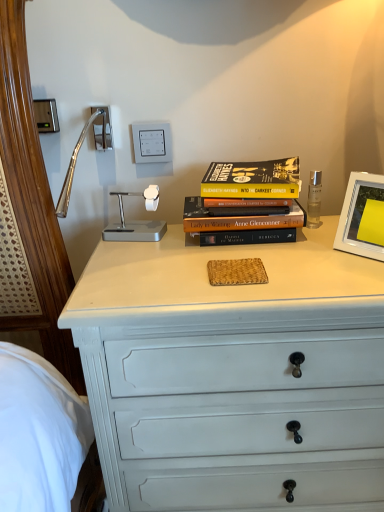
Question: Should I look upward or downward to see white plastic picture frame at upper right?

Choices:
 (A) up
 (B) down

Answer: (A)

Question: Does white painted wood chest of drawers at center have a greater height compared to white plastic switch at upper center, which appears as the first electric outlet when viewed from the right?

Choices:
 (A) no
 (B) yes

Answer: (B)

Question: Does white painted wood chest of drawers at center come behind white plastic switch at upper center, which appears as the first electric outlet when viewed from the right?

Choices:
 (A) no
 (B) yes

Answer: (A)

Question: From the image's perspective, would you say white painted wood chest of drawers at center is shown under white plastic switch at upper center, which appears as the first electric outlet when viewed from the right?

Choices:
 (A) no
 (B) yes

Answer: (B)

Question: From a real-world perspective, is white painted wood chest of drawers at center positioned over white plastic switch at upper center, which is the second electric outlet in left-to-right order, based on gravity?

Choices:
 (A) no
 (B) yes

Answer: (A)

Question: Does white painted wood chest of drawers at center have a greater width compared to white plastic switch at upper center, which appears as the first electric outlet when viewed from the right?

Choices:
 (A) yes
 (B) no

Answer: (A)

Question: Is white painted wood chest of drawers at center to the left of white plastic switch at upper center, which is the second electric outlet in left-to-right order, from the viewer's perspective?

Choices:
 (A) yes
 (B) no

Answer: (B)

Question: Can you confirm if hardcover book at center is smaller than white plastic picture frame at upper right?

Choices:
 (A) no
 (B) yes

Answer: (A)

Question: Does hardcover book at center come behind white plastic picture frame at upper right?

Choices:
 (A) no
 (B) yes

Answer: (B)

Question: Is hardcover book at center shorter than white plastic picture frame at upper right?

Choices:
 (A) no
 (B) yes

Answer: (A)

Question: Is hardcover book at center oriented towards white plastic picture frame at upper right?

Choices:
 (A) no
 (B) yes

Answer: (A)

Question: Is hardcover book at center positioned with its back to white plastic picture frame at upper right?

Choices:
 (A) no
 (B) yes

Answer: (A)

Question: Is hardcover book at center far from white plastic picture frame at upper right?

Choices:
 (A) yes
 (B) no

Answer: (B)

Question: Can satin nickel outlet at upper left, positioned as the 1th electric outlet in left-to-right order, be found inside white plastic picture frame at upper right?

Choices:
 (A) yes
 (B) no

Answer: (B)